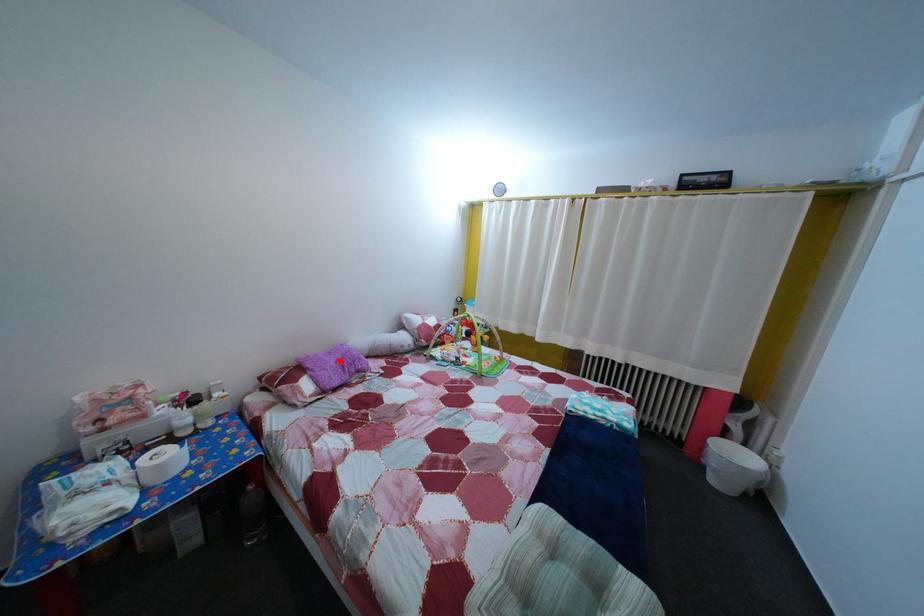
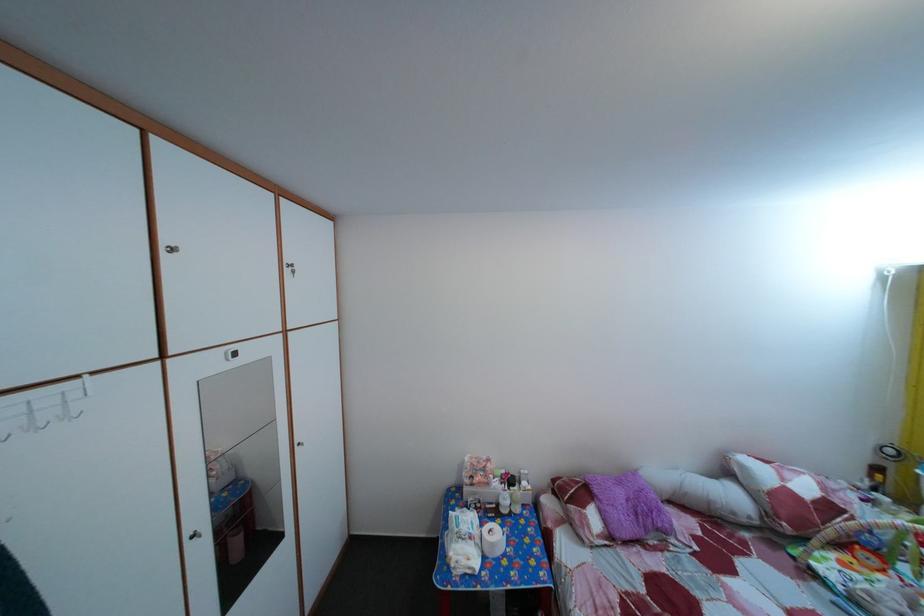
Question: I am providing you with two images of the same scene from different viewpoints. Given a red point in image1, look at the same physical point in image2. Is it:

Choices:
 (A) Closer to the viewpoint
 (B) Farther from the viewpoint

Answer: (B)